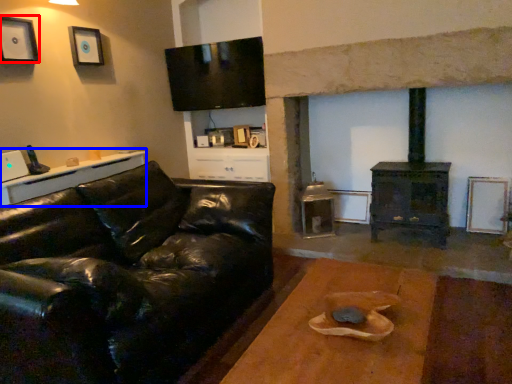
Question: Which of the following is the farthest to the observer, picture frame (highlighted by a red box) or table (highlighted by a blue box)?

Choices:
 (A) picture frame
 (B) table

Answer: (A)